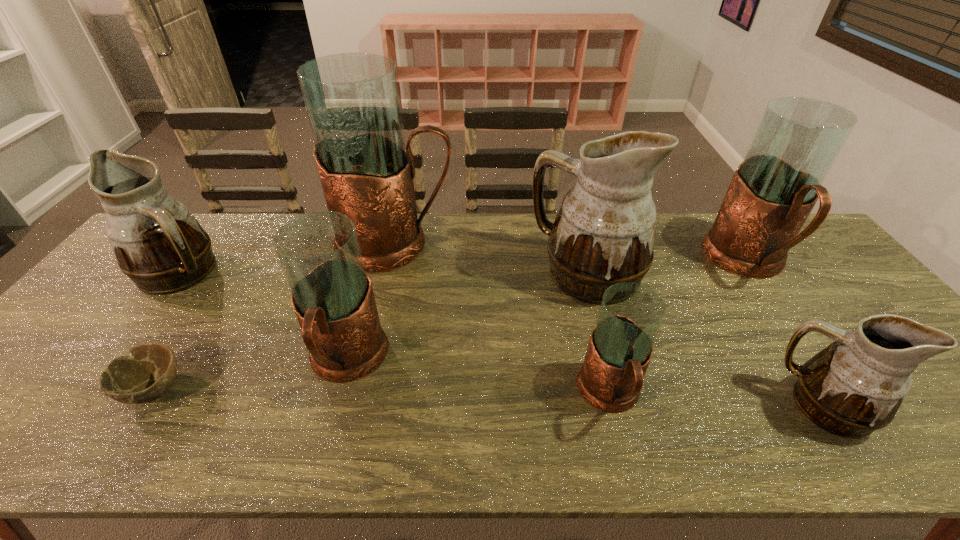
The image size is (960, 540). Find the location of `vacant space at the near right corner of the desktop`. vacant space at the near right corner of the desktop is located at coordinates (954, 452).

The image size is (960, 540). Find the location of `free space between the bowl and the third biggest gray pitcher`. free space between the bowl and the third biggest gray pitcher is located at coordinates (251, 375).

Locate an element on the screen. Image resolution: width=960 pixels, height=540 pixels. empty location between the smallest gray pitcher and the second smallest gray pitcher is located at coordinates (478, 378).

Find the location of a particular element. This screenshot has width=960, height=540. blank region between the leftmost brown pitcher and the smallest gray pitcher is located at coordinates (396, 333).

Where is `free space between the third gray pitcher from left to right and the second smallest gray pitcher`? This screenshot has height=540, width=960. free space between the third gray pitcher from left to right and the second smallest gray pitcher is located at coordinates (478, 378).

What are the coordinates of `free area in between the third biggest gray pitcher and the smallest gray pitcher` in the screenshot? It's located at (478, 378).

Point out which object is positioned as the fourth nearest to the third biggest gray pitcher. Please provide its 2D coordinates. Your answer should be formatted as a tuple, i.e. [(x, y)], where the tuple contains the x and y coordinates of a point satisfying the conditions above.

[(604, 233)]

Point out which object is positioned as the second nearest to the shortest object. Please provide its 2D coordinates. Your answer should be formatted as a tuple, i.e. [(x, y)], where the tuple contains the x and y coordinates of a point satisfying the conditions above.

[(319, 252)]

You are a GUI agent. You are given a task and a screenshot of the screen. Output one action in this format:
    pyautogui.click(x=<x>, y=<y>)
    Task: Click on the pitcher that is the sixth closest to the second gray pitcher from right to left
    The width and height of the screenshot is (960, 540).
    Given the screenshot: What is the action you would take?
    pyautogui.click(x=158, y=243)

Choose which pitcher is the third nearest neighbor to the third biggest gray pitcher. Please provide its 2D coordinates. Your answer should be formatted as a tuple, i.e. [(x, y)], where the tuple contains the x and y coordinates of a point satisfying the conditions above.

[(604, 233)]